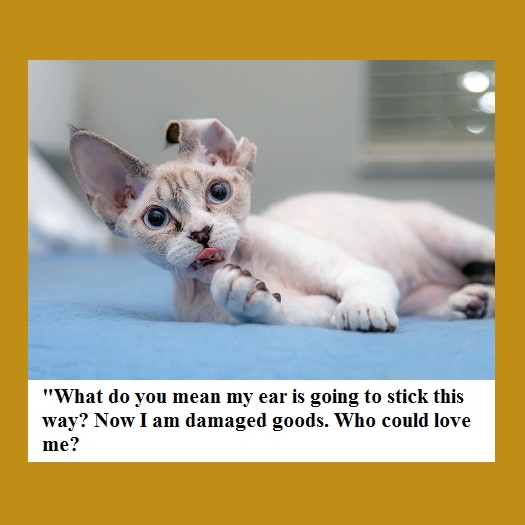
This screenshot has width=525, height=525. In order to click on blanket in this screenshot , I will do `click(162, 337)`.